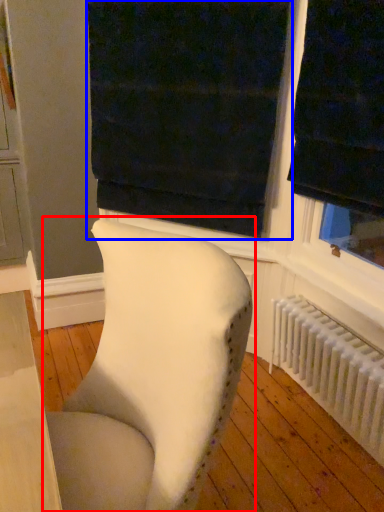
Question: Which of the following is the farthest to the observer, chair (highlighted by a red box) or curtain (highlighted by a blue box)?

Choices:
 (A) chair
 (B) curtain

Answer: (B)